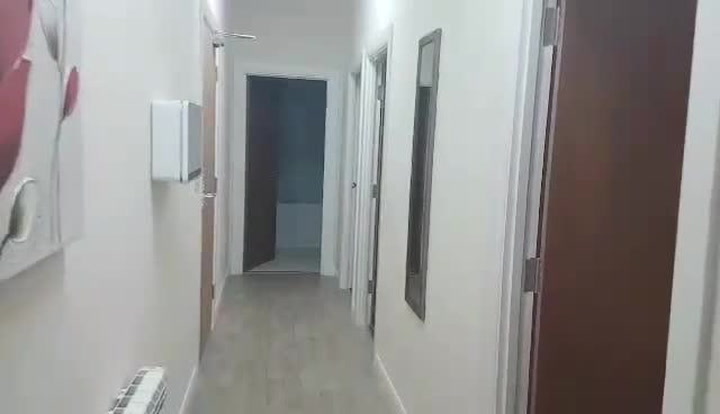
You are a GUI agent. You are given a task and a screenshot of the screen. Output one action in this format:
    pyautogui.click(x=<x>, y=<y>)
    Task: Click on the wall mirror
    The height and width of the screenshot is (414, 720).
    Given the screenshot: What is the action you would take?
    pyautogui.click(x=418, y=114)